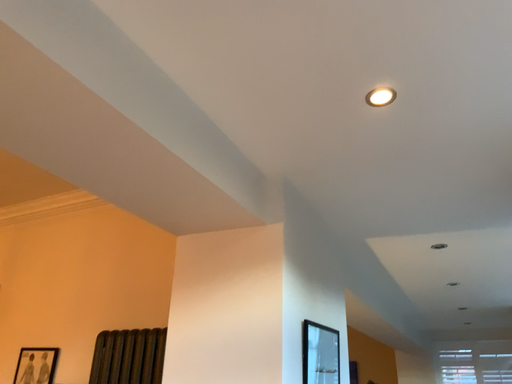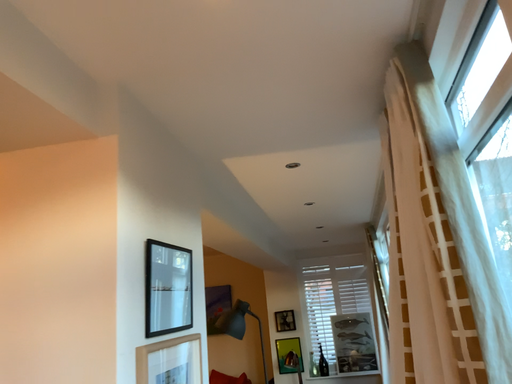
Question: Which way did the camera rotate in the video?

Choices:
 (A) rotated left
 (B) rotated right

Answer: (B)